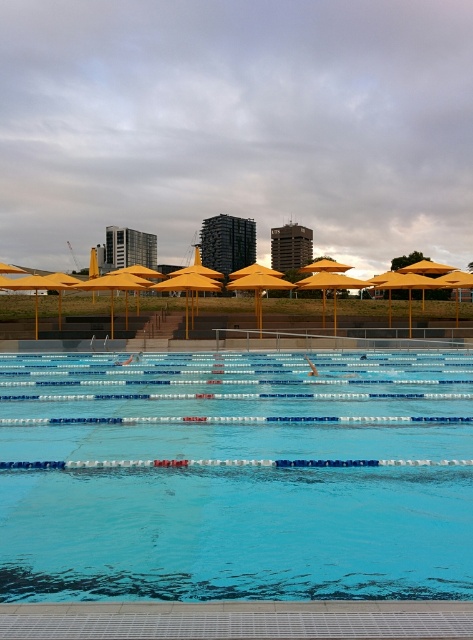
From the picture: You are standing at the edge of the pool and want to swim to the point marked as point [236,476]. Based on the scene description, is this point located on the clear blue water at center?

Yes, the point [236,476] is on the clear blue water at center, so swimming to that point would place you in the clear blue water at center.

You are a swimmer standing at the edge of the pool. You want to swim towards the yellow matte umbrella at center. Which direction should you swim to avoid the clear blue water at center?

To avoid the clear blue water at center, you should swim to the left side since the clear blue water at center is positioned on the right side of the yellow matte umbrella at center.